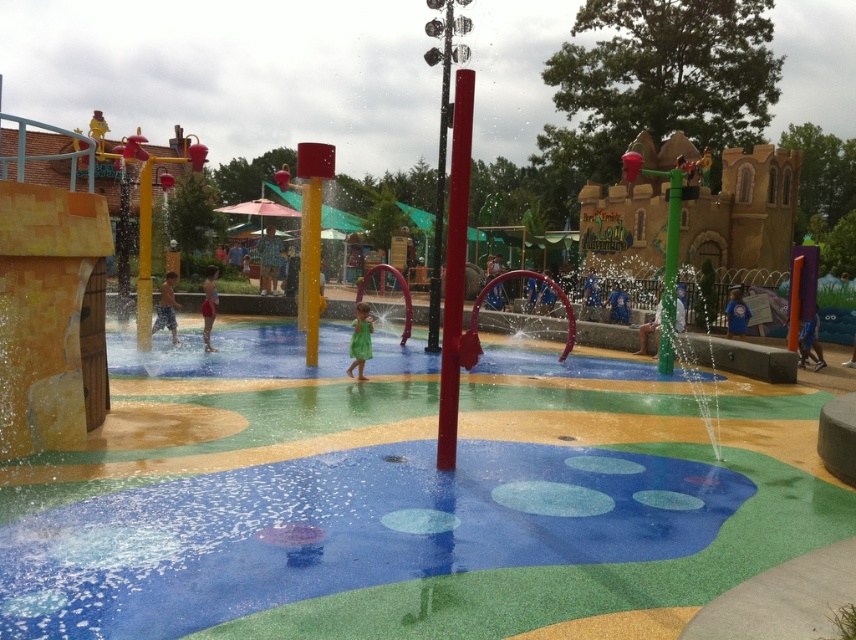
You are standing at the entrance of the water play area and want to reach the point closer to the camera. Which point should you head towards, point (161, 284) or point (217, 273)?

You should head towards point (161, 284) because it is further to the camera than point (217, 273).

You are a photographer trying to capture a clear shot of the smooth tan skin at center without the green matte dress at center blocking it. Is there a way to adjust your position to avoid the dress blocking the skin?

The green matte dress at center might be wider than smooth tan skin at center, so adjusting your position might help avoid the dress blocking the skin. Try moving to the side or slightly back to get a better angle.

Consider the image. You are a photographer trying to capture the green matte dress at center and the smooth tan skin at center in a single shot. Which object should you focus on first if you want to ensure both are in focus?

The green matte dress at center is positioned under smooth tan skin at center. To ensure both are in focus, you should focus on the smooth tan skin at center first since it is closer to the camera, allowing the green matte dress at center to be within the depth of field.